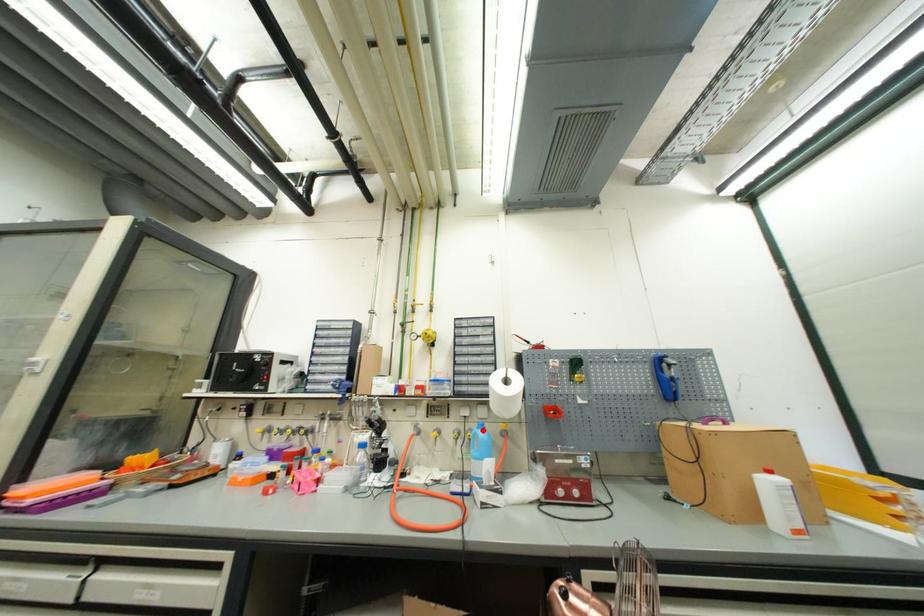
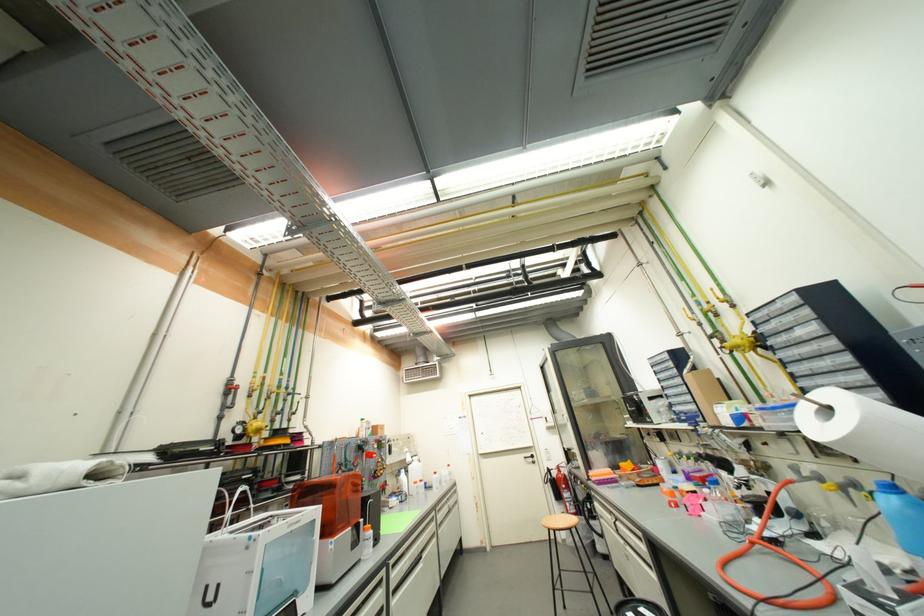
Question: I am providing you with two images of the same scene from different viewpoints. A red point is shown in image1. For the corresponding object point in image2, is it positioned nearer or farther from the camera?

Choices:
 (A) Nearer
 (B) Farther

Answer: (A)